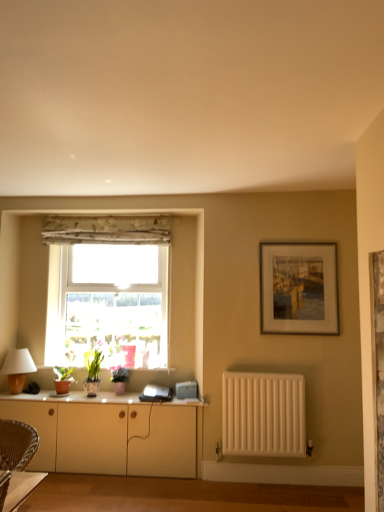
Question: From the image's perspective, is floral fabric curtain at upper center positioned above or below transparent glass window at center?

Choices:
 (A) above
 (B) below

Answer: (A)

Question: Is point (94, 237) positioned closer to the camera than point (84, 292)?

Choices:
 (A) farther
 (B) closer

Answer: (B)

Question: Which of these objects is positioned farthest from the satin white laptop at center?

Choices:
 (A) white glossy cabinet at lower center
 (B) wooden framed painting at upper right
 (C) floral fabric curtain at upper center
 (D) white matte cabinet at lower center
 (E) transparent glass window at center

Answer: (C)

Question: Based on their relative distances, which object is farther from the white matte cabinet at lower center?

Choices:
 (A) satin white laptop at center
 (B) wooden framed painting at upper right
 (C) white matte radiator at lower right
 (D) floral fabric curtain at upper center
 (E) white glossy cabinet at lower center

Answer: (D)